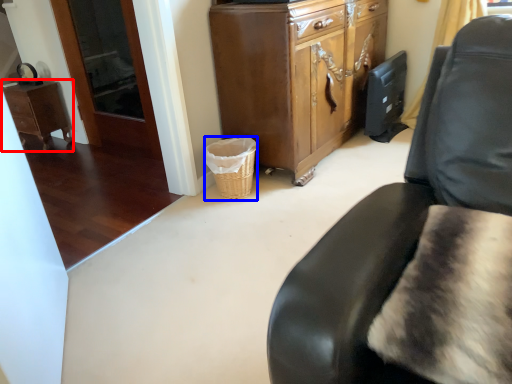
Question: Which point is closer to the camera, desk (highlighted by a red box) or basket (highlighted by a blue box)?

Choices:
 (A) desk
 (B) basket

Answer: (B)